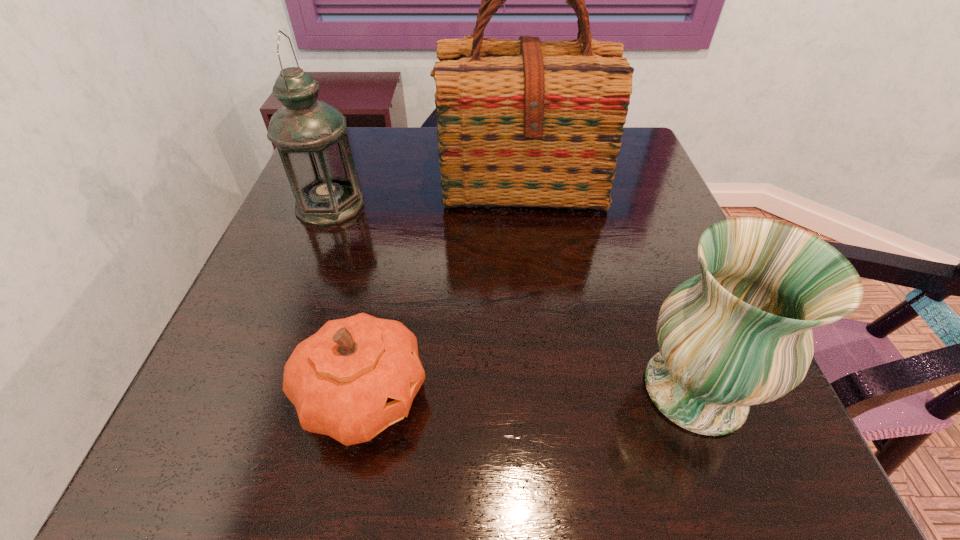
Find the location of `pumpkin that is at the near edge`. pumpkin that is at the near edge is located at coordinates (354, 377).

The image size is (960, 540). In order to click on object at the left edge in this screenshot , I will do `click(309, 134)`.

Where is `shopping bag that is positioned at the right edge`? This screenshot has height=540, width=960. shopping bag that is positioned at the right edge is located at coordinates (525, 123).

The width and height of the screenshot is (960, 540). In order to click on vase located in the right edge section of the desktop in this screenshot , I will do `click(739, 334)`.

Where is `object that is at the far right corner`? Image resolution: width=960 pixels, height=540 pixels. object that is at the far right corner is located at coordinates (525, 123).

This screenshot has height=540, width=960. I want to click on object that is at the near right corner, so click(739, 334).

The height and width of the screenshot is (540, 960). What are the coordinates of `free space at the near edge of the desktop` in the screenshot? It's located at (407, 490).

Identify the location of free point at the left edge. (306, 310).

Find the location of a particular element. free region at the right edge is located at coordinates (650, 342).

The width and height of the screenshot is (960, 540). Identify the location of free space at the near left corner of the desktop. (232, 478).